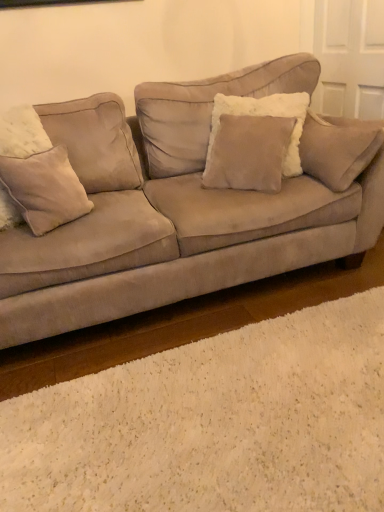
The width and height of the screenshot is (384, 512). I want to click on suede couch at center, so click(184, 207).

Where is `fuzzy beige pillow at left, placed as the 2th pillow when sorted from right to left`? The height and width of the screenshot is (512, 384). fuzzy beige pillow at left, placed as the 2th pillow when sorted from right to left is located at coordinates (45, 189).

In order to face suede/velvet pillow at center, positioned as the second pillow in left-to-right order, should I rotate leftwards or rightwards?

Turn right by 7.217 degrees to look at suede/velvet pillow at center, positioned as the second pillow in left-to-right order.

The width and height of the screenshot is (384, 512). I want to click on suede couch at center, so click(184, 207).

From the image's perspective, is suede/velvet pillow at center, positioned as the second pillow in left-to-right order, located above or below fuzzy beige pillow at left, the first pillow in the left-to-right sequence?

suede/velvet pillow at center, positioned as the second pillow in left-to-right order, is situated higher than fuzzy beige pillow at left, the first pillow in the left-to-right sequence, in the image.

Considering the relative sizes of suede/velvet pillow at center, which appears as the 1th pillow when viewed from the right, and fuzzy beige pillow at left, placed as the 2th pillow when sorted from right to left, in the image provided, is suede/velvet pillow at center, which appears as the 1th pillow when viewed from the right, wider than fuzzy beige pillow at left, placed as the 2th pillow when sorted from right to left,?

Correct, the width of suede/velvet pillow at center, which appears as the 1th pillow when viewed from the right, exceeds that of fuzzy beige pillow at left, placed as the 2th pillow when sorted from right to left.

Considering the relative sizes of suede/velvet pillow at center, which appears as the 1th pillow when viewed from the right, and fuzzy beige pillow at left, the first pillow in the left-to-right sequence, in the image provided, is suede/velvet pillow at center, which appears as the 1th pillow when viewed from the right, bigger than fuzzy beige pillow at left, the first pillow in the left-to-right sequence,?

Correct, suede/velvet pillow at center, which appears as the 1th pillow when viewed from the right, is larger in size than fuzzy beige pillow at left, the first pillow in the left-to-right sequence.

Consider the image. Are suede/velvet pillow at center, which appears as the 1th pillow when viewed from the right, and fuzzy beige pillow at left, placed as the 2th pillow when sorted from right to left, making contact?

No, suede/velvet pillow at center, which appears as the 1th pillow when viewed from the right, is not making contact with fuzzy beige pillow at left, placed as the 2th pillow when sorted from right to left.

What's the angular difference between suede couch at center and suede/velvet pillow at center, positioned as the second pillow in left-to-right order,'s facing directions?

The angular difference between suede couch at center and suede/velvet pillow at center, positioned as the second pillow in left-to-right order, is 48.5 degrees.

Is suede couch at center positioned far away from suede/velvet pillow at center, positioned as the second pillow in left-to-right order?

That's not correct — suede couch at center is a little close to suede/velvet pillow at center, positioned as the second pillow in left-to-right order.

Is suede couch at center to the left of suede/velvet pillow at center, which appears as the 1th pillow when viewed from the right, from the viewer's perspective?

Indeed, suede couch at center is positioned on the left side of suede/velvet pillow at center, which appears as the 1th pillow when viewed from the right.

Is fuzzy beige pillow at left, the first pillow in the left-to-right sequence, further to the viewer compared to suede couch at center?

That is True.

Which of these two, fuzzy beige pillow at left, placed as the 2th pillow when sorted from right to left, or suede couch at center, stands shorter?

fuzzy beige pillow at left, placed as the 2th pillow when sorted from right to left.

Are fuzzy beige pillow at left, the first pillow in the left-to-right sequence, and suede couch at center making contact?

fuzzy beige pillow at left, the first pillow in the left-to-right sequence, is not next to suede couch at center, and they're not touching.

Considering the relative positions of suede couch at center and fuzzy beige pillow at left, the first pillow in the left-to-right sequence, in the image provided, is suede couch at center to the left of fuzzy beige pillow at left, the first pillow in the left-to-right sequence, from the viewer's perspective?

Incorrect, suede couch at center is not on the left side of fuzzy beige pillow at left, the first pillow in the left-to-right sequence.

Who is bigger, suede couch at center or fuzzy beige pillow at left, the first pillow in the left-to-right sequence?

With larger size is suede couch at center.

Is suede couch at center far away from fuzzy beige pillow at left, placed as the 2th pillow when sorted from right to left?

suede couch at center is near fuzzy beige pillow at left, placed as the 2th pillow when sorted from right to left, not far away.

Consider the image. In terms of height, does suede/velvet pillow at center, positioned as the second pillow in left-to-right order, look taller or shorter compared to suede couch at center?

Clearly, suede/velvet pillow at center, positioned as the second pillow in left-to-right order, is shorter compared to suede couch at center.

Is suede/velvet pillow at center, which appears as the 1th pillow when viewed from the right, positioned with its back to suede couch at center?

Yes, suede/velvet pillow at center, which appears as the 1th pillow when viewed from the right, is positioned with its back facing suede couch at center.

Is suede/velvet pillow at center, which appears as the 1th pillow when viewed from the right, further to camera compared to suede couch at center?

Yes, suede/velvet pillow at center, which appears as the 1th pillow when viewed from the right, is behind suede couch at center.

From a real-world perspective, which object stands above the other?

suede/velvet pillow at center, positioned as the second pillow in left-to-right order.

In the scene shown: Is fuzzy beige pillow at left, the first pillow in the left-to-right sequence, positioned with its back to suede/velvet pillow at center, positioned as the second pillow in left-to-right order?

No, fuzzy beige pillow at left, the first pillow in the left-to-right sequence, is not facing away from suede/velvet pillow at center, positioned as the second pillow in left-to-right order.

Can you confirm if fuzzy beige pillow at left, the first pillow in the left-to-right sequence, is taller than suede/velvet pillow at center, which appears as the 1th pillow when viewed from the right?

No, fuzzy beige pillow at left, the first pillow in the left-to-right sequence, is not taller than suede/velvet pillow at center, which appears as the 1th pillow when viewed from the right.

Would you say fuzzy beige pillow at left, placed as the 2th pillow when sorted from right to left, contains suede/velvet pillow at center, positioned as the second pillow in left-to-right order?

No, suede/velvet pillow at center, positioned as the second pillow in left-to-right order, is not inside fuzzy beige pillow at left, placed as the 2th pillow when sorted from right to left.

Find the location of a particular element. The image size is (384, 512). pillow in front of the suede/velvet pillow at center, positioned as the second pillow in left-to-right order is located at coordinates (45, 189).

Locate an element on the screen. studio couch below the suede/velvet pillow at center, positioned as the second pillow in left-to-right order (from the image's perspective) is located at coordinates (184, 207).

From the image, which object appears to be nearer to suede couch at center, fuzzy beige pillow at left, placed as the 2th pillow when sorted from right to left, or suede/velvet pillow at center, which appears as the 1th pillow when viewed from the right?

Based on the image, suede/velvet pillow at center, which appears as the 1th pillow when viewed from the right, appears to be nearer to suede couch at center.

Estimate the real-world distances between objects in this image. Which object is closer to suede/velvet pillow at center, positioned as the second pillow in left-to-right order, fuzzy beige pillow at left, placed as the 2th pillow when sorted from right to left, or suede couch at center?

Among the two, suede couch at center is located nearer to suede/velvet pillow at center, positioned as the second pillow in left-to-right order.

Considering their positions, is suede couch at center positioned further to suede/velvet pillow at center, which appears as the 1th pillow when viewed from the right, than fuzzy beige pillow at left, the first pillow in the left-to-right sequence?

Among the two, fuzzy beige pillow at left, the first pillow in the left-to-right sequence, is located further to suede/velvet pillow at center, which appears as the 1th pillow when viewed from the right.

Which object lies nearer to the anchor point fuzzy beige pillow at left, the first pillow in the left-to-right sequence, suede couch at center or suede/velvet pillow at center, positioned as the second pillow in left-to-right order?

suede couch at center.

From the picture: Based on their spatial positions, is suede/velvet pillow at center, which appears as the 1th pillow when viewed from the right, or suede couch at center further from fuzzy beige pillow at left, placed as the 2th pillow when sorted from right to left?

suede/velvet pillow at center, which appears as the 1th pillow when viewed from the right, is positioned further to the anchor fuzzy beige pillow at left, placed as the 2th pillow when sorted from right to left.

From the image, which object appears to be farther from suede couch at center, suede/velvet pillow at center, which appears as the 1th pillow when viewed from the right, or fuzzy beige pillow at left, the first pillow in the left-to-right sequence?

Based on the image, fuzzy beige pillow at left, the first pillow in the left-to-right sequence, appears to be further to suede couch at center.

Where is `studio couch between fuzzy beige pillow at left, placed as the 2th pillow when sorted from right to left, and suede/velvet pillow at center, positioned as the second pillow in left-to-right order, from left to right`? studio couch between fuzzy beige pillow at left, placed as the 2th pillow when sorted from right to left, and suede/velvet pillow at center, positioned as the second pillow in left-to-right order, from left to right is located at coordinates (184, 207).